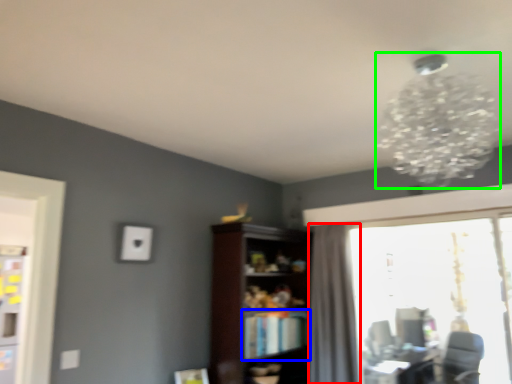
Question: Based on their relative distances, which object is nearer to curtain (highlighted by a red box)? Choose from book (highlighted by a blue box) and lamp (highlighted by a green box).

Choices:
 (A) book
 (B) lamp

Answer: (A)